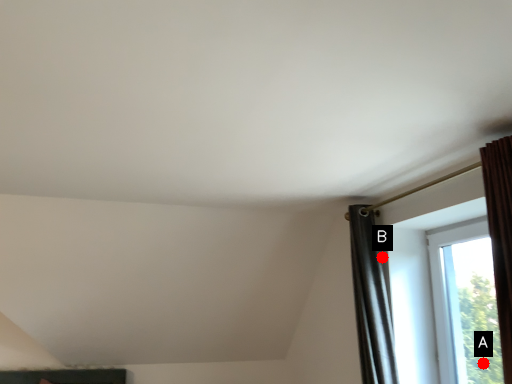
Question: Two points are circled on the image, labeled by A and B beside each circle. Which point appears closest to the camera in this image?

Choices:
 (A) A is closer
 (B) B is closer

Answer: (A)